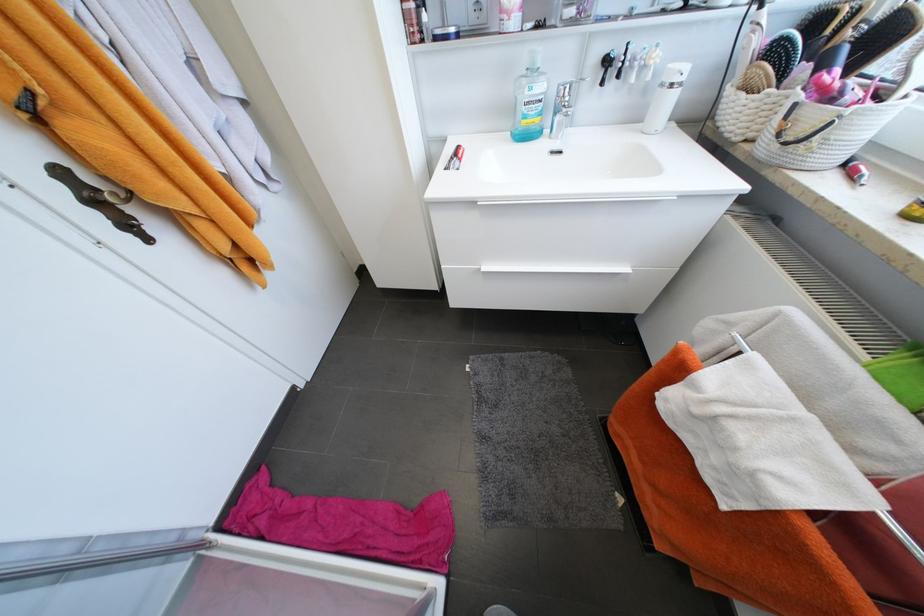
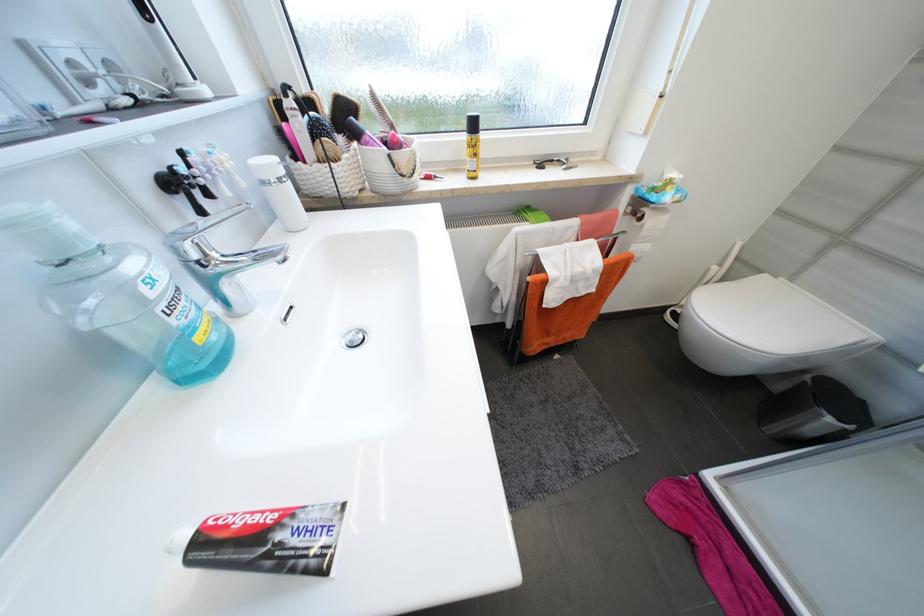
The point at (x=613, y=62) is marked in the first image. Where is the corresponding point in the second image?

(178, 185)